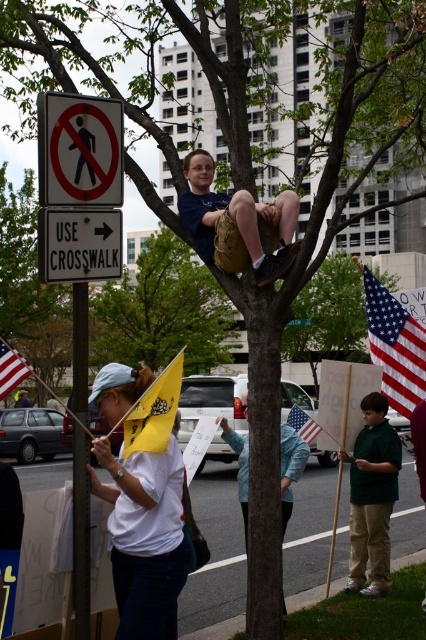
Question: Is white matte shirt at center bigger than black plastic sign at upper left?

Choices:
 (A) yes
 (B) no

Answer: (B)

Question: Considering the real-world distances, which object is farthest from the american flag at lower left?

Choices:
 (A) yellow paper flag at center
 (B) white plastic sign at upper left
 (C) black plastic pole at left
 (D) american flag at center

Answer: (D)

Question: From the image, what is the correct spatial relationship of white matte shirt at center in relation to green matte shirt at lower right?

Choices:
 (A) left
 (B) right

Answer: (A)

Question: Is green matte shirt at lower right thinner than american flag at lower left?

Choices:
 (A) no
 (B) yes

Answer: (B)

Question: Among these points, which one is nearest to the camera?

Choices:
 (A) (368, 477)
 (B) (80, 204)
 (C) (389, 310)

Answer: (B)

Question: Which object appears farthest from the camera in this image?

Choices:
 (A) black plastic sign at upper left
 (B) white matte shirt at center

Answer: (B)